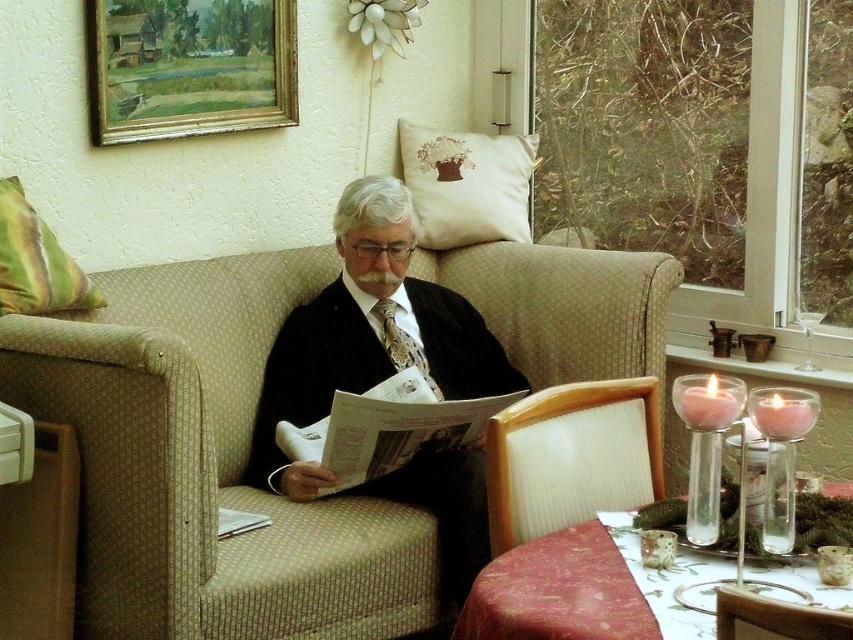
Question: Among these points, which one is farthest from the camera?

Choices:
 (A) (343, 257)
 (B) (787, 618)
 (C) (550, 492)

Answer: (A)

Question: Which point appears farthest from the camera in this image?

Choices:
 (A) (433, 173)
 (B) (215, 390)
 (C) (82, 276)
 (D) (491, 524)

Answer: (A)

Question: Estimate the real-world distances between objects in this image. Which object is closer to the green striped pillow at left?

Choices:
 (A) white textured chair at lower right
 (B) matte black suit at center
 (C) white embroidered cushion at upper center
 (D) gold-framed painting at upper left

Answer: (D)

Question: Does gold-framed painting at upper left have a smaller size compared to green striped pillow at left?

Choices:
 (A) yes
 (B) no

Answer: (B)

Question: Observing the image, what is the correct spatial positioning of gold-framed painting at upper left in reference to white textured chair at lower right?

Choices:
 (A) below
 (B) above

Answer: (B)

Question: Is gold-framed painting at upper left positioned in front of wooden chair at lower right?

Choices:
 (A) no
 (B) yes

Answer: (A)